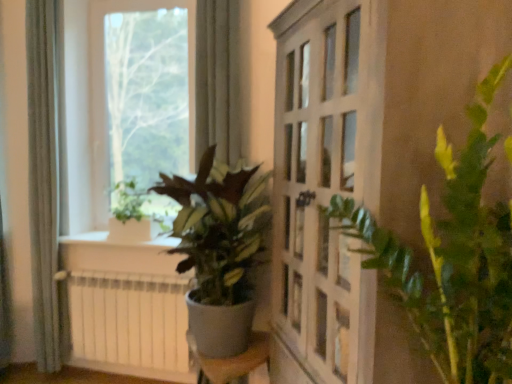
Question: From the image's perspective, is transparent glass window at upper left positioned above or below white matte radiator at lower left?

Choices:
 (A) above
 (B) below

Answer: (A)

Question: Would you say transparent glass window at upper left is to the left or to the right of white matte radiator at lower left in the picture?

Choices:
 (A) right
 (B) left

Answer: (B)

Question: Which object is positioned closest to the green matte plant at center, the second houseplant positioned from the front?

Choices:
 (A) transparent glass window at upper left
 (B) green leafy plant at right, the 3th houseplant when ordered from back to front
 (C) white glossy window sill at lower left
 (D) white matte radiator at lower left
 (E) green matte plant at upper left, which is the third houseplant in front-to-back order

Answer: (D)

Question: Which of these objects is positioned closest to the white glossy window sill at lower left?

Choices:
 (A) gray fabric curtain at left
 (B) green leafy plant at right, which is the first houseplant from front to back
 (C) white matte radiator at lower left
 (D) green matte plant at center, the second houseplant in the back-to-front sequence
 (E) green matte plant at upper left, placed as the first houseplant when sorted from back to front

Answer: (E)